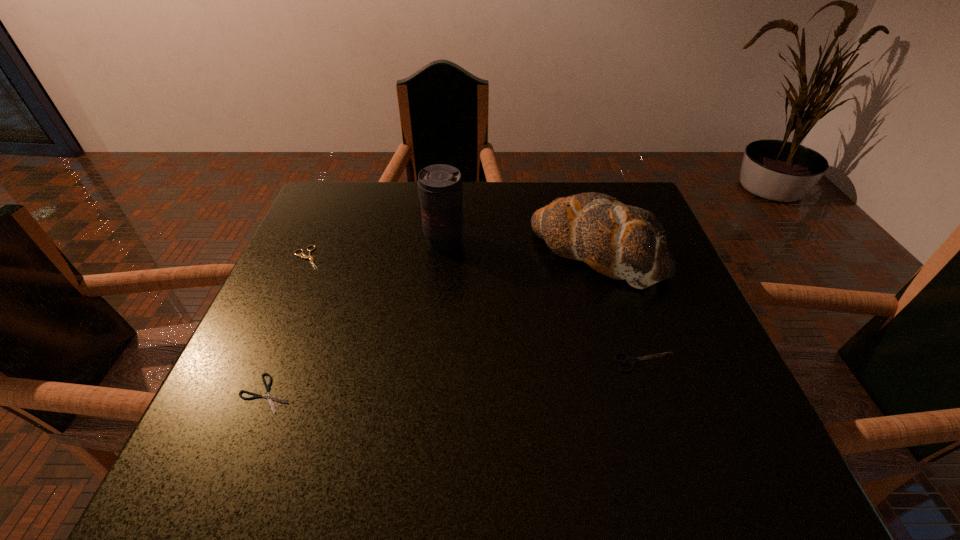
The width and height of the screenshot is (960, 540). I want to click on free space at the near edge, so click(x=521, y=474).

You are a GUI agent. You are given a task and a screenshot of the screen. Output one action in this format:
    pyautogui.click(x=<x>, y=<y>)
    Task: Click on the vacant space at the left edge
    The height and width of the screenshot is (540, 960).
    Given the screenshot: What is the action you would take?
    pyautogui.click(x=319, y=246)

In order to click on vacant space at the right edge of the desktop in this screenshot , I will do (617, 292).

Where is `vacant space at the near left corner of the desktop`? vacant space at the near left corner of the desktop is located at coordinates (237, 482).

This screenshot has height=540, width=960. Identify the location of free spot between the shortest shears and the fourth farthest object. (456, 378).

Where is `free space that is in between the third object from right to left and the farthest shears`? Image resolution: width=960 pixels, height=540 pixels. free space that is in between the third object from right to left and the farthest shears is located at coordinates (375, 249).

What are the coordinates of `vacant space in between the tallest object and the second farthest shears` in the screenshot? It's located at (544, 302).

Find the location of `empty location between the tallest object and the farthest shears`. empty location between the tallest object and the farthest shears is located at coordinates (375, 249).

This screenshot has width=960, height=540. Identify the location of free spot between the fourth farthest object and the shortest object. pos(456,378).

The image size is (960, 540). Identify the location of vacant space in between the telephoto lens and the bread. (520, 246).